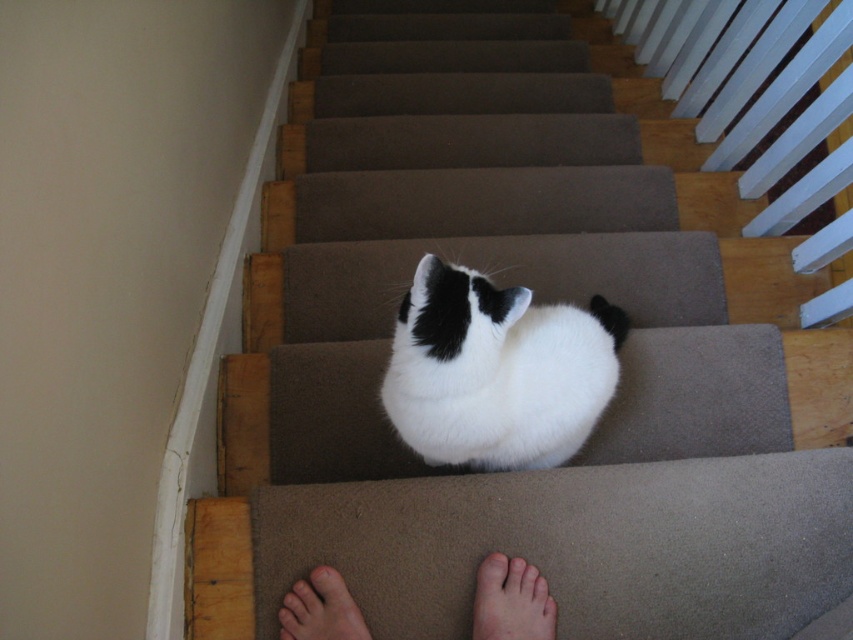
Who is shorter, white fluffy cat at center or pale skin at lower center?

Standing shorter between the two is pale skin at lower center.

Who is positioned more to the left, white fluffy cat at center or pale skin at lower center?

Positioned to the left is white fluffy cat at center.

What do you see at coordinates (496, 371) in the screenshot?
I see `white fluffy cat at center` at bounding box center [496, 371].

At what (x,y) coordinates should I click in order to perform the action: click on white fluffy cat at center. Please return your answer as a coordinate pair (x, y). Looking at the image, I should click on (496, 371).

You are a GUI agent. You are given a task and a screenshot of the screen. Output one action in this format:
    pyautogui.click(x=<x>, y=<y>)
    Task: Click on the white fluffy cat at center
    
    Given the screenshot: What is the action you would take?
    pyautogui.click(x=496, y=371)

Can you confirm if white fluffy cat at center is wider than light brown skin at lower center?

Indeed, white fluffy cat at center has a greater width compared to light brown skin at lower center.

Is point (397, 396) positioned behind point (289, 632)?

No, it is not.

At what (x,y) coordinates should I click in order to perform the action: click on white fluffy cat at center. Please return your answer as a coordinate pair (x, y). Looking at the image, I should click on (496, 371).

Who is higher up, pale skin at lower center or light brown skin at lower center?

Positioned higher is pale skin at lower center.

Between point (491, 588) and point (322, 618), which one is positioned behind?

Positioned behind is point (491, 588).

Locate an element on the screen. pale skin at lower center is located at coordinates (511, 602).